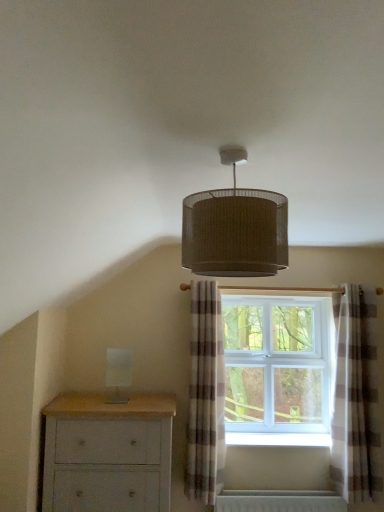
Question: Does light gray painted wood chest of drawers at lower left have a smaller size compared to plaid fabric curtain at center, the 2th curtain from the right?

Choices:
 (A) yes
 (B) no

Answer: (B)

Question: From the image's perspective, would you say light gray painted wood chest of drawers at lower left is shown under plaid fabric curtain at center, which ranks as the first curtain in left-to-right order?

Choices:
 (A) no
 (B) yes

Answer: (B)

Question: Can you see light gray painted wood chest of drawers at lower left touching plaid fabric curtain at center, which ranks as the first curtain in left-to-right order?

Choices:
 (A) no
 (B) yes

Answer: (A)

Question: Is light gray painted wood chest of drawers at lower left shorter than plaid fabric curtain at center, the 2th curtain from the right?

Choices:
 (A) yes
 (B) no

Answer: (A)

Question: Is light gray painted wood chest of drawers at lower left located outside plaid fabric curtain at center, the 2th curtain from the right?

Choices:
 (A) no
 (B) yes

Answer: (B)

Question: Relative to matte brown lampshade at upper center, is plaid fabric curtain at center, which appears as the first curtain when viewed from the right, in front or behind?

Choices:
 (A) behind
 (B) front

Answer: (A)

Question: From a real-world perspective, relative to matte brown lampshade at upper center, is plaid fabric curtain at center, positioned as the second curtain in left-to-right order, vertically above or below?

Choices:
 (A) above
 (B) below

Answer: (B)

Question: Is plaid fabric curtain at center, positioned as the second curtain in left-to-right order, inside or outside of matte brown lampshade at upper center?

Choices:
 (A) inside
 (B) outside

Answer: (B)

Question: Would you say plaid fabric curtain at center, which appears as the first curtain when viewed from the right, is to the left or to the right of matte brown lampshade at upper center in the picture?

Choices:
 (A) right
 (B) left

Answer: (A)

Question: In terms of height, does white painted wood at lower center look taller or shorter compared to plaid fabric curtain at center, which appears as the first curtain when viewed from the right?

Choices:
 (A) tall
 (B) short

Answer: (B)

Question: Looking at their shapes, would you say white painted wood at lower center is wider or thinner than plaid fabric curtain at center, positioned as the second curtain in left-to-right order?

Choices:
 (A) wide
 (B) thin

Answer: (A)

Question: From the image's perspective, is white painted wood at lower center above or below plaid fabric curtain at center, which appears as the first curtain when viewed from the right?

Choices:
 (A) above
 (B) below

Answer: (B)

Question: From a real-world perspective, is white painted wood at lower center physically located above or below plaid fabric curtain at center, which appears as the first curtain when viewed from the right?

Choices:
 (A) above
 (B) below

Answer: (B)

Question: Considering the relative positions of white plastic window at center and light gray painted wood chest of drawers at lower left in the image provided, is white plastic window at center to the left or to the right of light gray painted wood chest of drawers at lower left?

Choices:
 (A) left
 (B) right

Answer: (B)

Question: Does point (294, 305) appear closer or farther from the camera than point (145, 406)?

Choices:
 (A) farther
 (B) closer

Answer: (A)